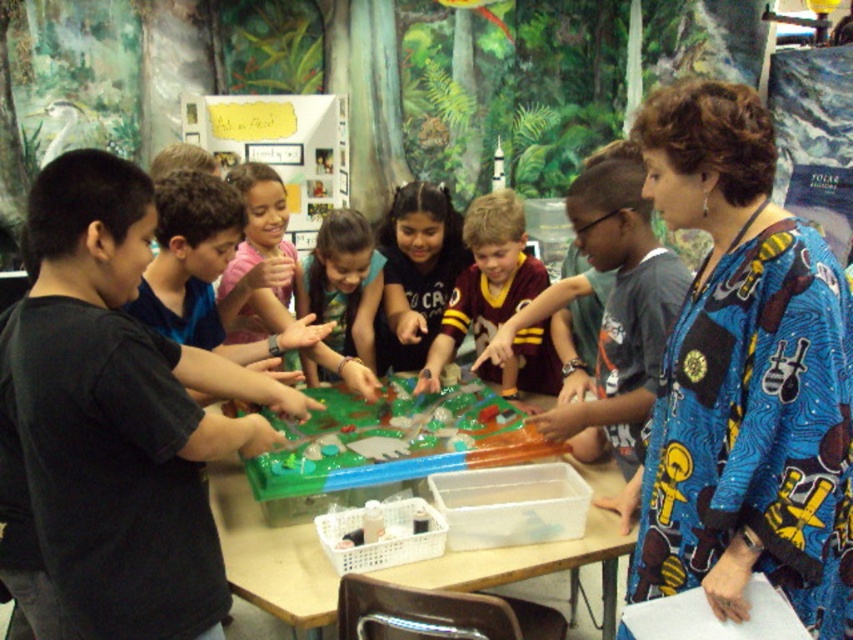
Is blue printed dress at upper right to the right of matte brown shirt at center from the viewer's perspective?

Indeed, blue printed dress at upper right is positioned on the right side of matte brown shirt at center.

This screenshot has width=853, height=640. What do you see at coordinates (746, 378) in the screenshot?
I see `blue printed dress at upper right` at bounding box center [746, 378].

Where is `blue printed dress at upper right`? blue printed dress at upper right is located at coordinates (746, 378).

From the picture: Is maroon jersey at center above matte brown shirt at center?

No, maroon jersey at center is not above matte brown shirt at center.

Does maroon jersey at center have a smaller size compared to matte brown shirt at center?

No.

Which is behind, point (465, 273) or point (410, 355)?

The point (410, 355) is more distant.

This screenshot has width=853, height=640. Find the location of `maroon jersey at center`. maroon jersey at center is located at coordinates (485, 280).

Is clear plastic table at center wider than smooth green shirt at center?

Yes, clear plastic table at center is wider than smooth green shirt at center.

What do you see at coordinates (271, 556) in the screenshot?
I see `clear plastic table at center` at bounding box center [271, 556].

Image resolution: width=853 pixels, height=640 pixels. I want to click on clear plastic table at center, so click(x=271, y=556).